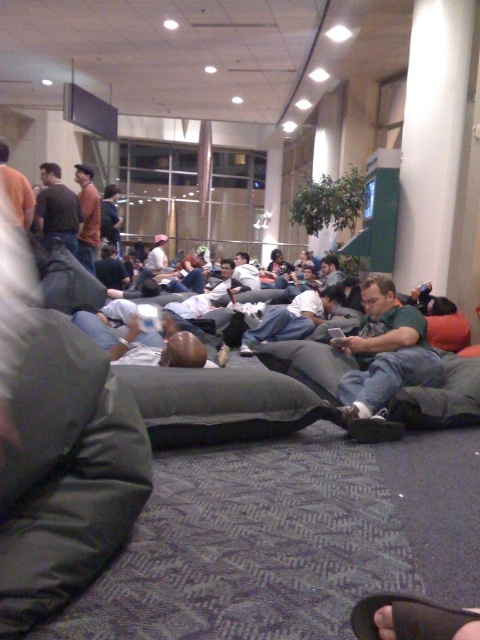
Can you confirm if green cotton shirt at center is thinner than dark brown leather jacket at center?

Incorrect, green cotton shirt at center's width is not less than dark brown leather jacket at center's.

Which is above, green cotton shirt at center or dark brown leather jacket at center?

dark brown leather jacket at center is higher up.

Is point (435, 385) closer to camera compared to point (75, 221)?

That is True.

The image size is (480, 640). What are the coordinates of `green cotton shirt at center` in the screenshot? It's located at (384, 362).

Does dark brown leather jacket at center have a smaller size compared to white cotton shirt at center?

No.

Does point (55, 230) lie in front of point (241, 284)?

Yes, point (55, 230) is closer to viewer.

Where is `dark brown leather jacket at center`? The image size is (480, 640). dark brown leather jacket at center is located at coordinates (57, 211).

Does point (313, 298) lie behind point (55, 241)?

Yes, it is.

In the scene shown: Which is more to the left, denim jeans at center or dark brown leather jacket at center?

Positioned to the left is dark brown leather jacket at center.

Is point (316, 301) in front of point (75, 243)?

That is True.

This screenshot has height=640, width=480. I want to click on denim jeans at center, so click(x=291, y=317).